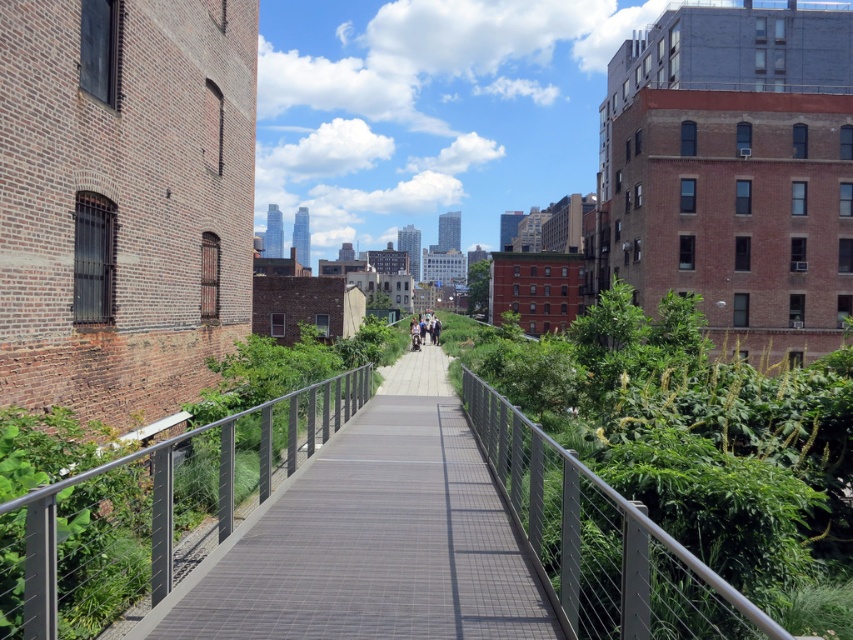
Question: Can you confirm if metallic gray bridge at center is positioned to the right of metallic gray rail at center?

Choices:
 (A) no
 (B) yes

Answer: (A)

Question: Is metallic gray rail at center further to camera compared to light brown wooden bench at center?

Choices:
 (A) no
 (B) yes

Answer: (A)

Question: Can you confirm if metallic gray bridge at center is smaller than metallic gray rail at center?

Choices:
 (A) yes
 (B) no

Answer: (B)

Question: Which point appears farthest from the camera in this image?

Choices:
 (A) (634, 556)
 (B) (567, 614)
 (C) (439, 328)

Answer: (C)

Question: Which of the following is the farthest from the observer?

Choices:
 (A) (310, 420)
 (B) (428, 321)
 (C) (602, 502)

Answer: (B)

Question: Based on their relative distances, which object is nearer to the metallic gray rail at center?

Choices:
 (A) metallic gray bridge at center
 (B) light brown wooden bench at center

Answer: (A)